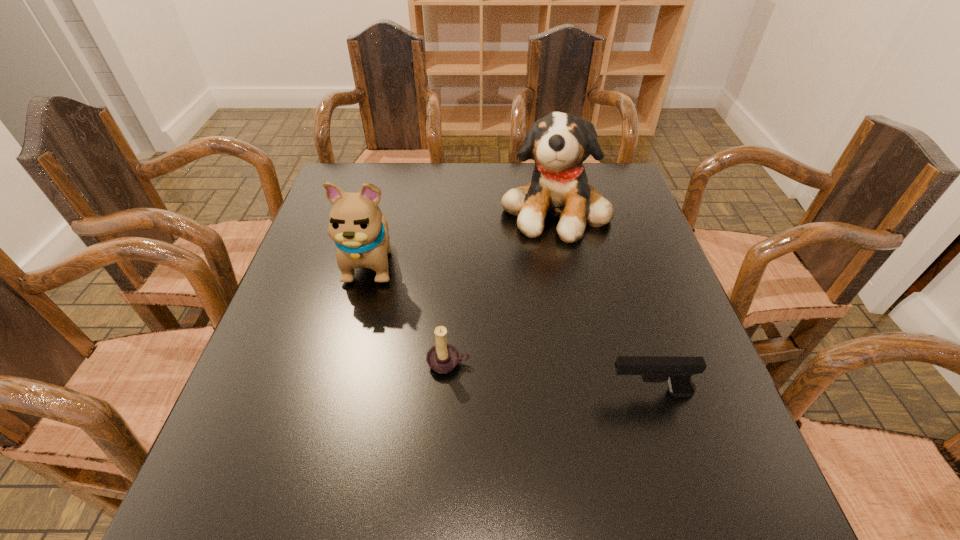
This screenshot has height=540, width=960. Find the location of `the right puppy`. the right puppy is located at coordinates (559, 143).

Identify the location of the leftmost object. (356, 224).

The width and height of the screenshot is (960, 540). I want to click on the third farthest object, so click(x=443, y=357).

Find the location of `the second object from left to right`. the second object from left to right is located at coordinates (443, 357).

Locate an element on the screen. The height and width of the screenshot is (540, 960). the nearest object is located at coordinates [677, 371].

This screenshot has height=540, width=960. Identify the location of vacant region located at the face of the right puppy. (574, 302).

Locate an element on the screen. vacant space located on the face of the left puppy is located at coordinates (351, 340).

The height and width of the screenshot is (540, 960). Identify the location of vacant region located on the wick of the second object from left to right. (439, 519).

Where is `vacant region located 0.400m on the front-facing side of the pistol`? vacant region located 0.400m on the front-facing side of the pistol is located at coordinates (398, 393).

Locate an element on the screen. The height and width of the screenshot is (540, 960). free space located on the front-facing side of the pistol is located at coordinates (440, 393).